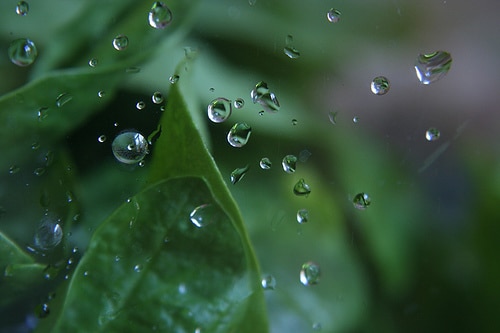
The image size is (500, 333). I want to click on area highlighted by light, so click(203, 76).